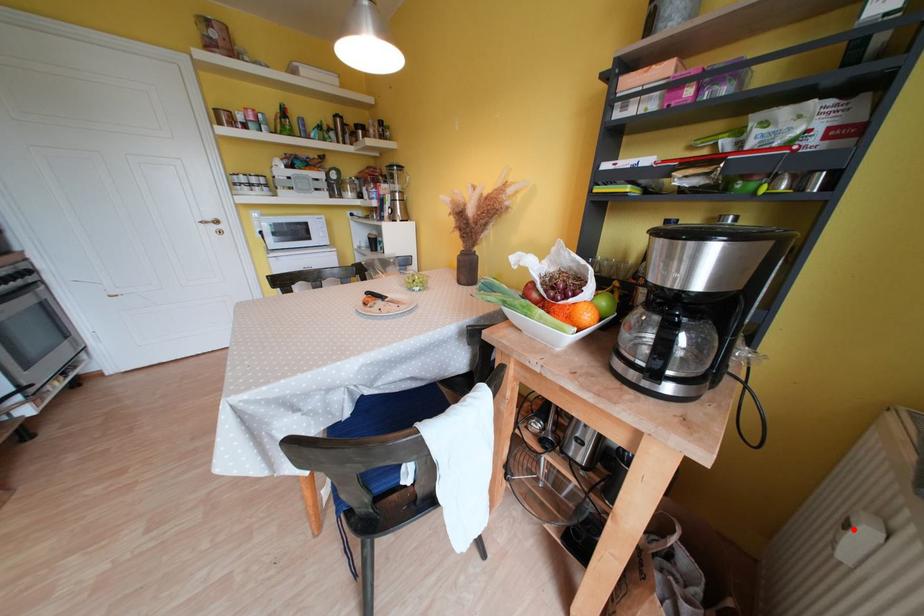
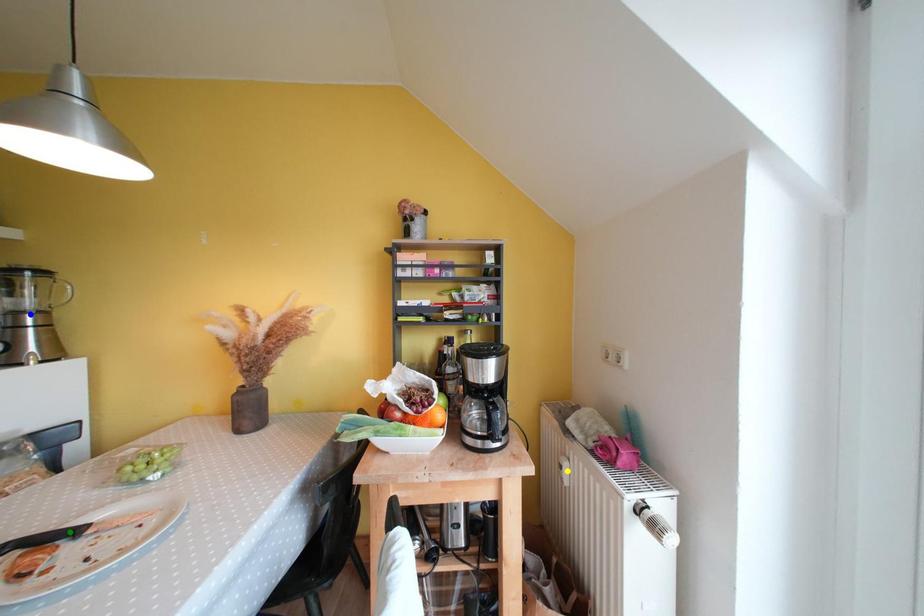
Question: I am providing you with two images of the same scene from different viewpoints. A red point is marked on the first image. You are given multiple points on the second image. Which point in image 2 is actually the same real-world point as the red point in image 1?

Choices:
 (A) blue point
 (B) yellow point
 (C) green point

Answer: (B)